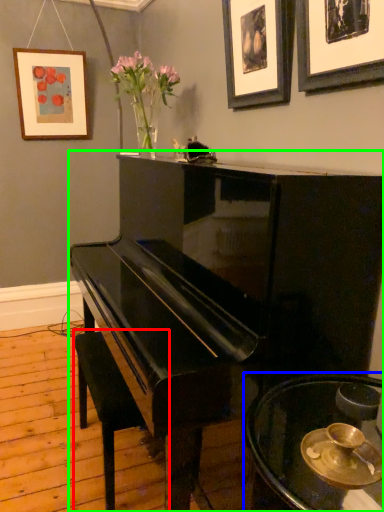
Question: Considering the real-world distances, which object is closest to music stool (highlighted by a red box)? table (highlighted by a blue box) or piano (highlighted by a green box).

Choices:
 (A) table
 (B) piano

Answer: (B)